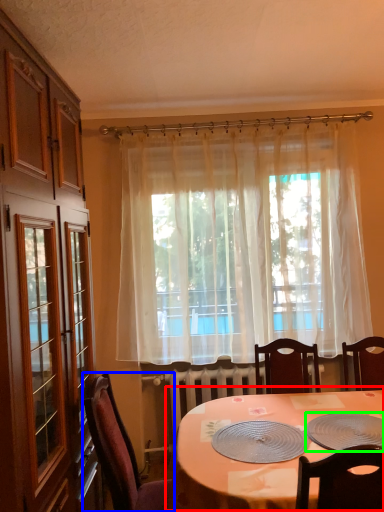
Question: Which is farther away from table (highlighted by a red box)? chair (highlighted by a blue box) or platter (highlighted by a green box)?

Choices:
 (A) chair
 (B) platter

Answer: (A)